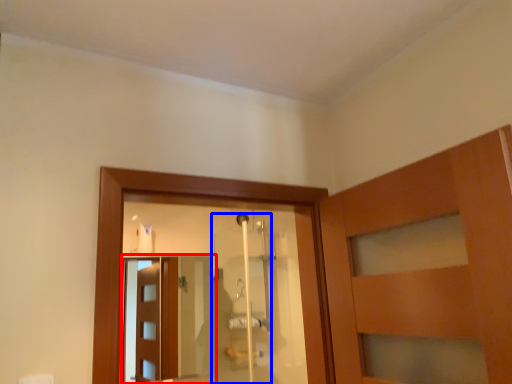
Question: Which object appears closest to the camera in this image, screen door (highlighted by a red box) or shower door (highlighted by a blue box)?

Choices:
 (A) screen door
 (B) shower door

Answer: (B)